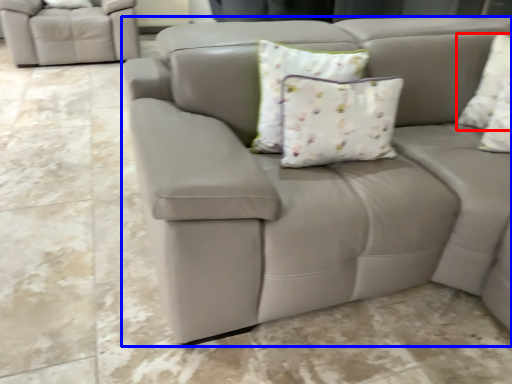
Question: Which object appears closest to the camera in this image, pillow (highlighted by a red box) or studio couch (highlighted by a blue box)?

Choices:
 (A) pillow
 (B) studio couch

Answer: (B)